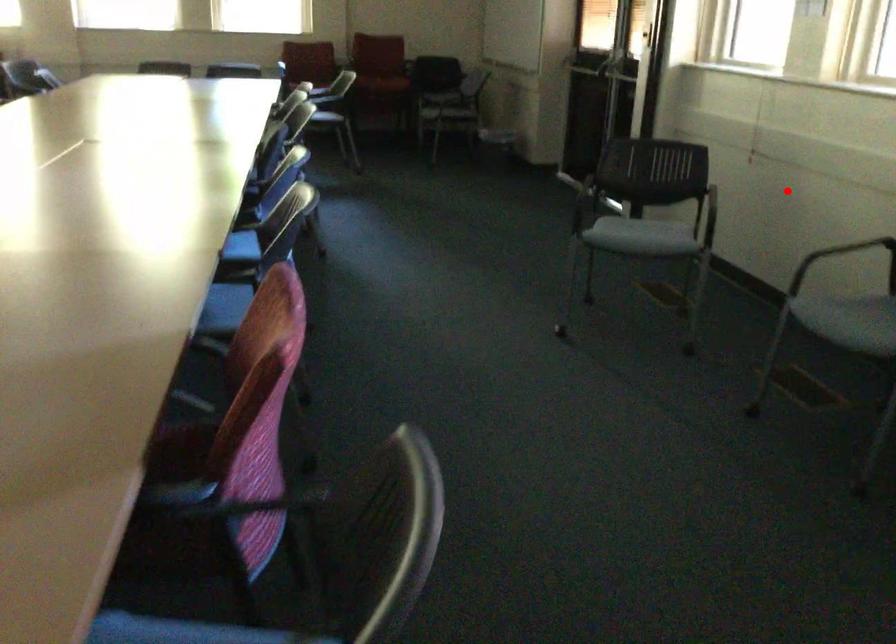
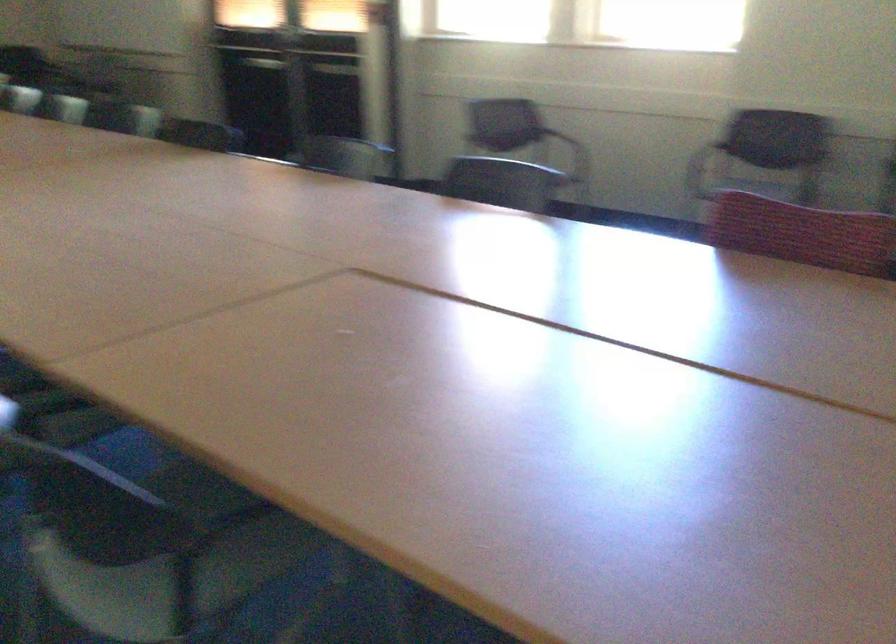
Question: I am providing you with two images of the same scene from different viewpoints. Given a red point in image1, look at the same physical point in image2. Is it:

Choices:
 (A) Closer to the viewpoint
 (B) Farther from the viewpoint

Answer: (B)